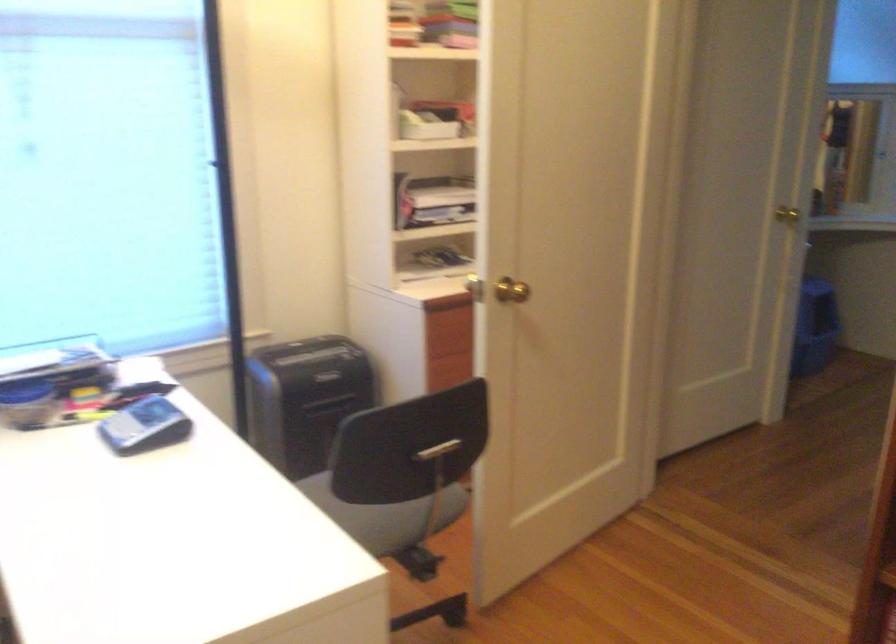
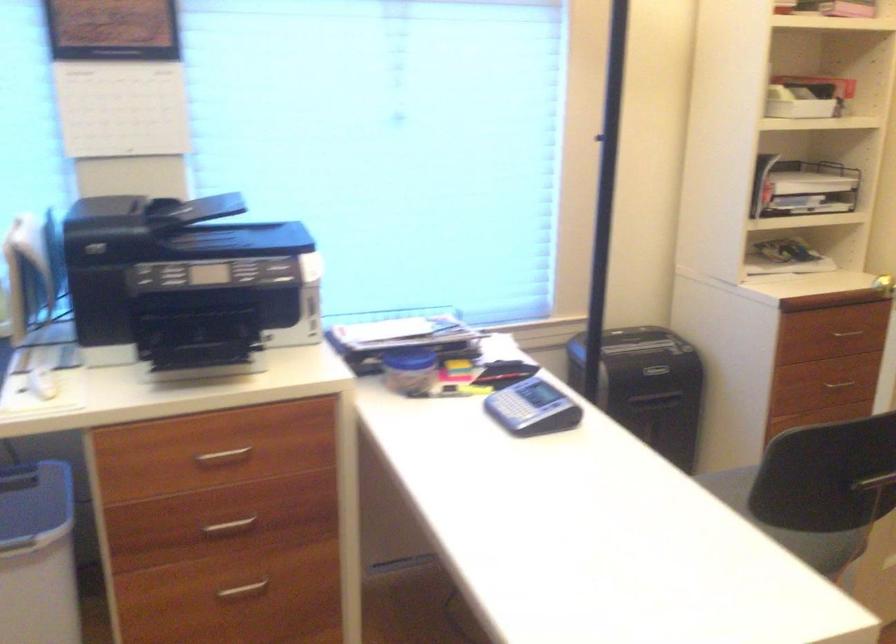
Where in the second image is the point corresponding to (x=383, y=515) from the first image?

(764, 535)